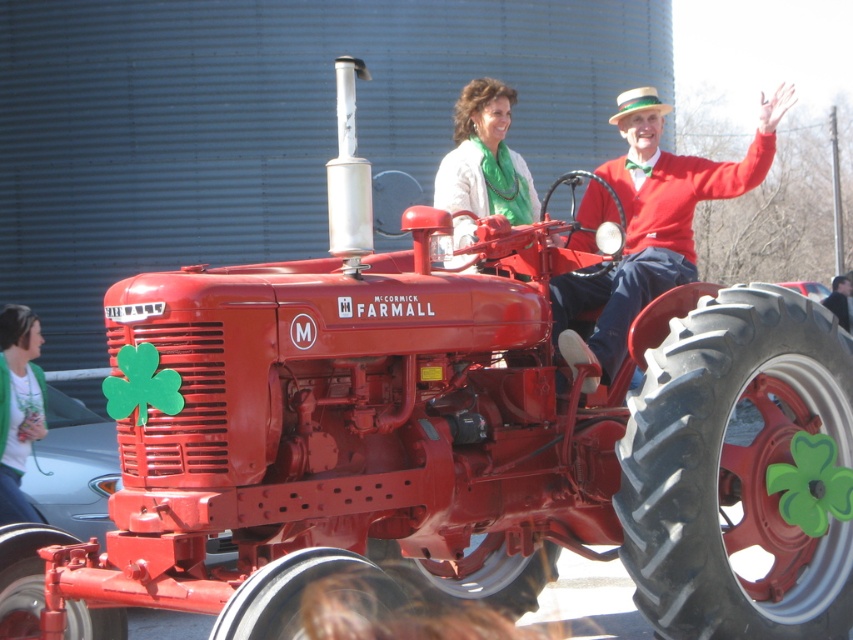
The width and height of the screenshot is (853, 640). What are the coordinates of `matte green scarf at center` in the screenshot? It's located at (485, 157).

Describe the element at coordinates (485, 157) in the screenshot. The height and width of the screenshot is (640, 853). I see `matte green scarf at center` at that location.

Identify the location of matte green scarf at center. (485, 157).

Does red wool sweater at center appear on the right side of green knitted sweater at lower left?

Indeed, red wool sweater at center is positioned on the right side of green knitted sweater at lower left.

Is point (605, 170) farther from camera compared to point (1, 497)?

Yes, it is.

At what (x,y) coordinates should I click in order to perform the action: click on red wool sweater at center. Please return your answer as a coordinate pair (x, y). Image resolution: width=853 pixels, height=640 pixels. Looking at the image, I should click on (653, 225).

Between red wool sweater at center and matte green scarf at center, which one is positioned lower?

matte green scarf at center is below.

Find the location of `red wool sweater at center`. red wool sweater at center is located at coordinates (653, 225).